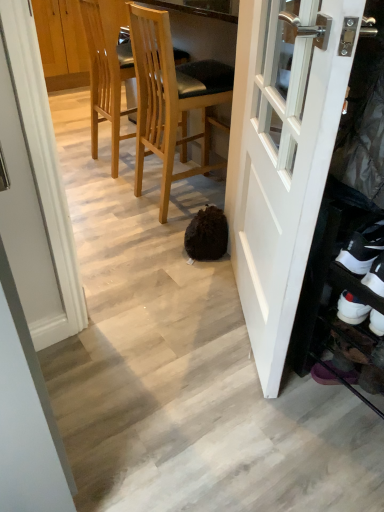
Question: Are white suede shoe at lower right, placed as the first shoe when sorted from back to front, and white glossy door at right beside each other?

Choices:
 (A) yes
 (B) no

Answer: (B)

Question: Considering the relative sizes of white suede shoe at lower right, placed as the first shoe when sorted from back to front, and white glossy door at right in the image provided, is white suede shoe at lower right, placed as the first shoe when sorted from back to front, taller than white glossy door at right?

Choices:
 (A) no
 (B) yes

Answer: (A)

Question: Considering the relative positions of white suede shoe at lower right, placed as the first shoe when sorted from back to front, and white glossy door at right in the image provided, is white suede shoe at lower right, placed as the first shoe when sorted from back to front, in front of white glossy door at right?

Choices:
 (A) no
 (B) yes

Answer: (A)

Question: From a real-world perspective, does white suede shoe at lower right, acting as the 2th shoe starting from the front, stand above white glossy door at right?

Choices:
 (A) yes
 (B) no

Answer: (B)

Question: Is white suede shoe at lower right, placed as the first shoe when sorted from back to front, oriented away from white glossy door at right?

Choices:
 (A) no
 (B) yes

Answer: (A)

Question: Considering the relative sizes of white suede shoe at lower right, placed as the first shoe when sorted from back to front, and white glossy door at right in the image provided, is white suede shoe at lower right, placed as the first shoe when sorted from back to front, smaller than white glossy door at right?

Choices:
 (A) yes
 (B) no

Answer: (A)

Question: Is white suede shoe at lower right, placed as the first shoe when sorted from back to front, shorter than white suede shoe at lower right, marked as the first shoe in a front-to-back arrangement?

Choices:
 (A) yes
 (B) no

Answer: (A)

Question: Considering the relative sizes of white suede shoe at lower right, acting as the 2th shoe starting from the front, and white suede shoe at lower right, marked as the first shoe in a front-to-back arrangement, in the image provided, is white suede shoe at lower right, acting as the 2th shoe starting from the front, bigger than white suede shoe at lower right, marked as the first shoe in a front-to-back arrangement,?

Choices:
 (A) no
 (B) yes

Answer: (A)

Question: Is white suede shoe at lower right, placed as the first shoe when sorted from back to front, with white suede shoe at lower right, marked as the first shoe in a front-to-back arrangement?

Choices:
 (A) no
 (B) yes

Answer: (B)

Question: Would you consider white suede shoe at lower right, acting as the 2th shoe starting from the front, to be distant from white suede shoe at lower right, marked as the first shoe in a front-to-back arrangement?

Choices:
 (A) yes
 (B) no

Answer: (B)

Question: Does white suede shoe at lower right, placed as the first shoe when sorted from back to front, lie in front of white suede shoe at lower right, marked as the first shoe in a front-to-back arrangement?

Choices:
 (A) no
 (B) yes

Answer: (A)

Question: From the image's perspective, does white suede shoe at lower right, acting as the 2th shoe starting from the front, appear lower than white suede shoe at lower right, marked as the second shoe in a back-to-front arrangement?

Choices:
 (A) yes
 (B) no

Answer: (A)

Question: Could you tell me if white suede shoe at lower right, placed as the first shoe when sorted from back to front, is facing light brown wood chair at center, the 1th chair in the left-to-right sequence?

Choices:
 (A) yes
 (B) no

Answer: (B)